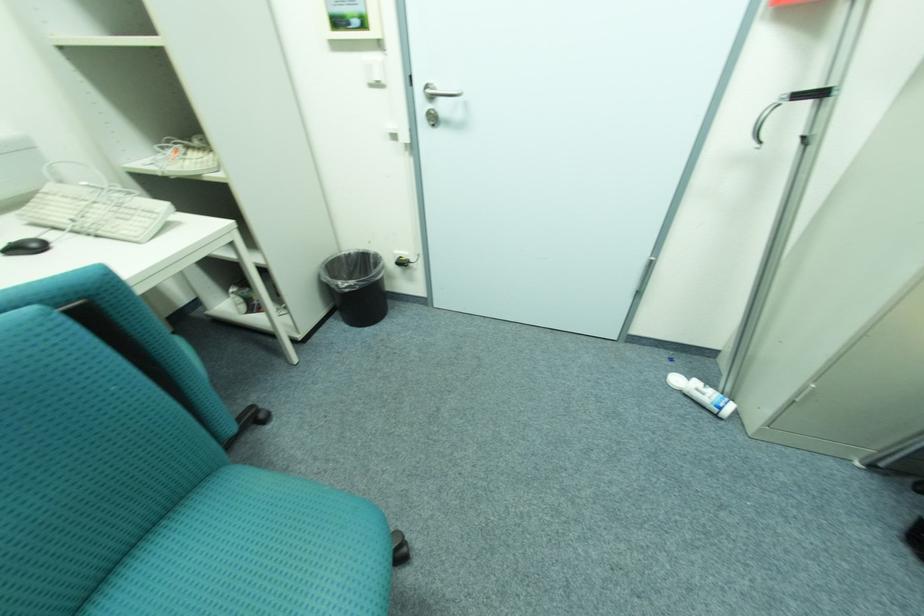
Find where to pull the silver door handle. Please return your answer as a coordinate pair (x, y).

(438, 92)